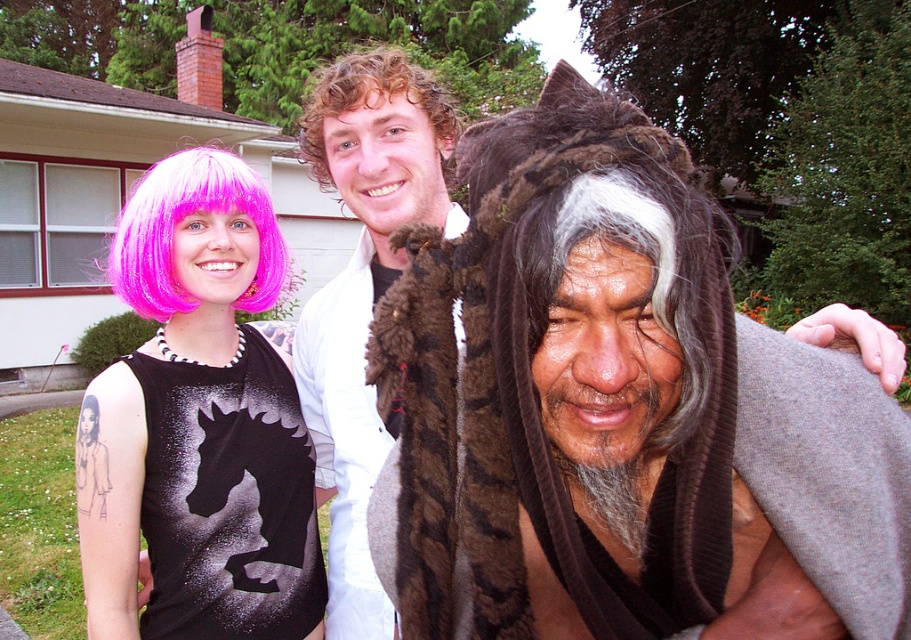
Question: Estimate the real-world distances between objects in this image. Which object is closer to the pink wig at upper left?

Choices:
 (A) curly blonde hair at center
 (B) fuzzy brown fur hat at center

Answer: (B)

Question: Considering the relative positions of fuzzy brown fur hat at center and curly blonde hair at center in the image provided, where is fuzzy brown fur hat at center located with respect to curly blonde hair at center?

Choices:
 (A) above
 (B) below

Answer: (B)

Question: Which object is closer to the camera taking this photo?

Choices:
 (A) curly blonde hair at center
 (B) fuzzy brown fur hat at center
 (C) pink synthetic wig at left

Answer: (B)

Question: Does fuzzy brown fur hat at center appear on the right side of pink wig at upper left?

Choices:
 (A) no
 (B) yes

Answer: (B)

Question: Which point is farther from the camera taking this photo?

Choices:
 (A) (232, 179)
 (B) (308, 90)
 (C) (115, 282)
 (D) (613, 284)

Answer: (B)

Question: Is pink wig at upper left closer to the viewer compared to curly blonde hair at center?

Choices:
 (A) yes
 (B) no

Answer: (A)